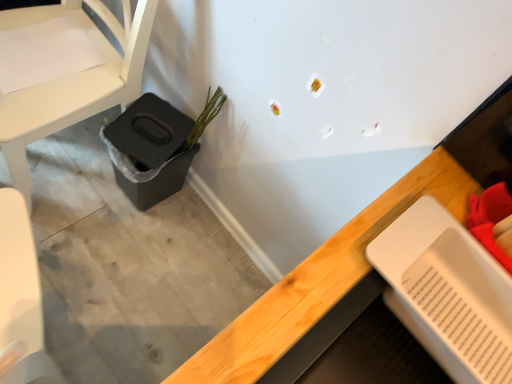
Question: Based on their sizes in the image, would you say white matte chair at left is bigger or smaller than green matte plant at lower left?

Choices:
 (A) big
 (B) small

Answer: (A)

Question: Is white matte chair at left spatially inside green matte plant at lower left, or outside of it?

Choices:
 (A) inside
 (B) outside

Answer: (B)

Question: Estimate the real-world distances between objects in this image. Which object is closer to the white plastic tray at lower right?

Choices:
 (A) white matte chair at left
 (B) black plastic potty at lower left
 (C) green matte plant at lower left

Answer: (C)

Question: Which is nearer to the white plastic tray at lower right?

Choices:
 (A) black plastic potty at lower left
 (B) green matte plant at lower left
 (C) white matte chair at left

Answer: (B)